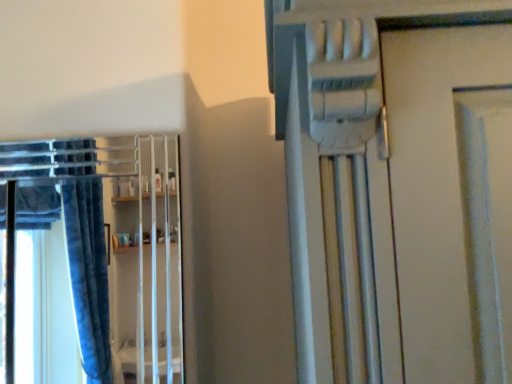
The width and height of the screenshot is (512, 384). What are the coordinates of `blue fabric curtain at left` in the screenshot? It's located at (61, 262).

Image resolution: width=512 pixels, height=384 pixels. What do you see at coordinates (61, 262) in the screenshot? I see `blue fabric curtain at left` at bounding box center [61, 262].

Measure the distance between point (56,330) and camera.

7.77 feet.

Locate an element on the screen. blue fabric curtain at left is located at coordinates (61, 262).